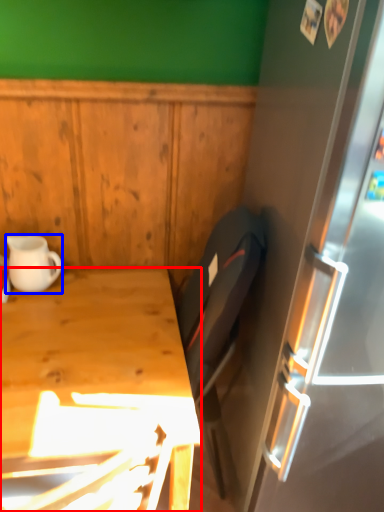
Question: Among these objects, which one is farthest to the camera, desk (highlighted by a red box) or coffee cup (highlighted by a blue box)?

Choices:
 (A) desk
 (B) coffee cup

Answer: (B)